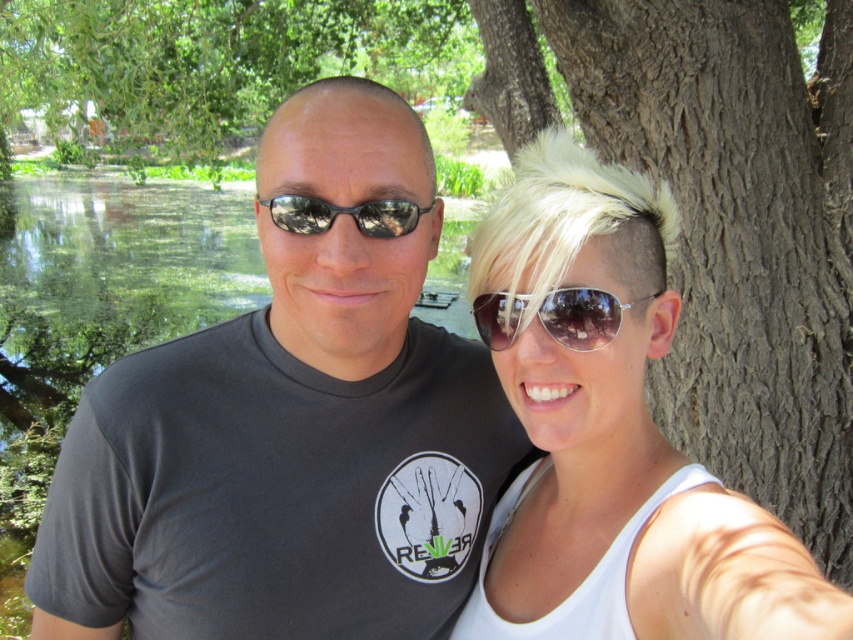
Can you confirm if matte gray t-shirt at center is bigger than shiny silver sunglasses at center?

Yes, matte gray t-shirt at center is bigger than shiny silver sunglasses at center.

The width and height of the screenshot is (853, 640). I want to click on matte gray t-shirt at center, so click(x=289, y=428).

Who is positioned more to the left, matte gray t-shirt at center or blonde hair at center?

matte gray t-shirt at center

Image resolution: width=853 pixels, height=640 pixels. Describe the element at coordinates (289, 428) in the screenshot. I see `matte gray t-shirt at center` at that location.

The image size is (853, 640). Identify the location of matte gray t-shirt at center. coord(289,428).

Can you confirm if matte gray t-shirt at center is positioned to the left of black reflective sunglasses at center?

Indeed, matte gray t-shirt at center is positioned on the left side of black reflective sunglasses at center.

In the scene shown: Who is more distant from viewer, (364,337) or (294,230)?

The point (364,337) is behind.

Does point (161, 620) come farther from viewer compared to point (293, 221)?

Yes, it is.

You are a GUI agent. You are given a task and a screenshot of the screen. Output one action in this format:
    pyautogui.click(x=<x>, y=<y>)
    Task: Click on the matte gray t-shirt at center
    The width and height of the screenshot is (853, 640).
    Given the screenshot: What is the action you would take?
    point(289,428)